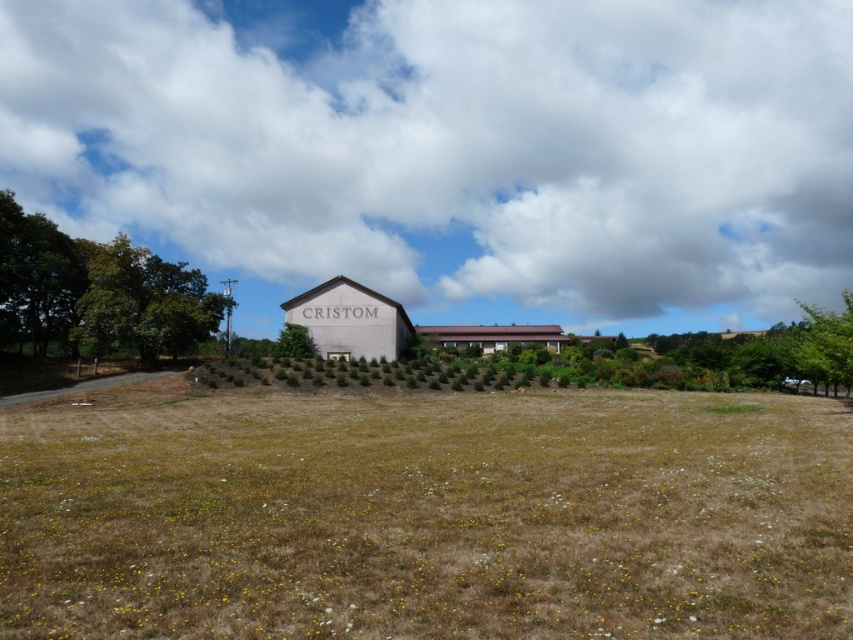
You are standing in the field with dry grass and small white flowers. You see the white fluffy cloud at upper center and the brown corrugated metal barn at center. Which object is located higher in the sky?

The white fluffy cloud at upper center is positioned over the brown corrugated metal barn at center, so it is higher in the sky.

You are a drone operator tasked with capturing aerial footage of the CRISTOM building. You notice the white fluffy cloud at upper center and the brown corrugated metal barn at center. Which object is positioned higher in the sky?

The white fluffy cloud at upper center is much taller than the brown corrugated metal barn at center, so the cloud is positioned higher in the sky.

You are an artist planning to paint the scene of the CRISTOM building. You need to decide which object to make larger in your painting to emphasize the sky. Should you enlarge the white fluffy cloud at upper center or the green leafy tree at center?

You should enlarge the white fluffy cloud at upper center because it is already bigger than the green leafy tree at center, helping to emphasize the sky.